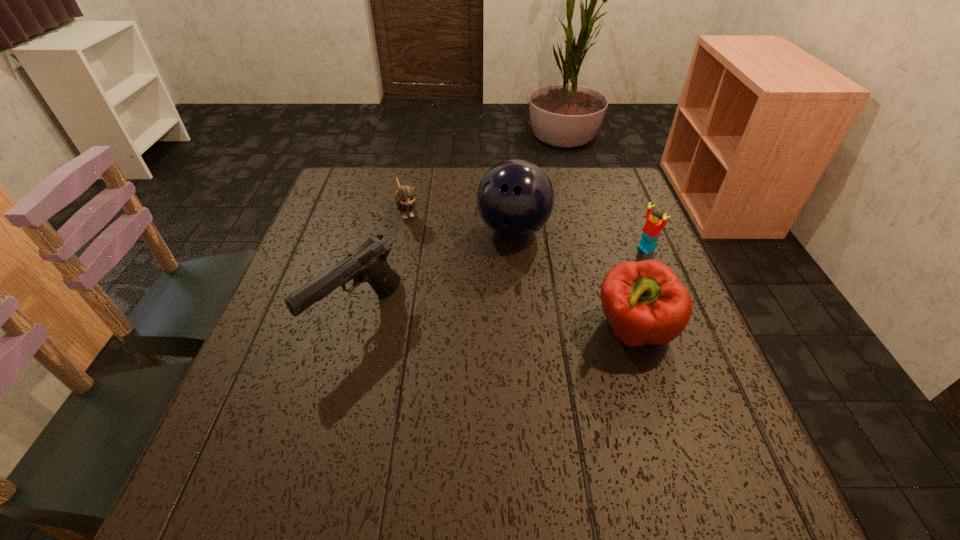
At what (x,y) coordinates should I click in order to perform the action: click on free space that satisfies the following two spatial constraints: 1. on the front side of the bowling ball; 2. on the right side of the kitten. Please return your answer as a coordinate pair (x, y). Looking at the image, I should click on (404, 230).